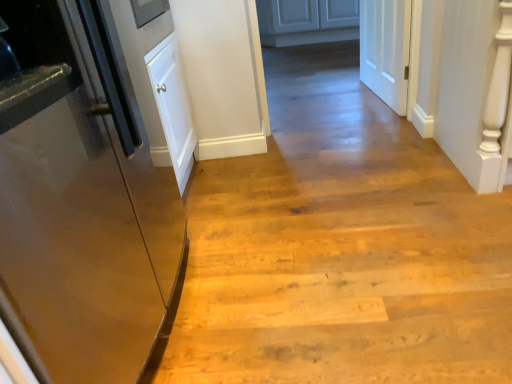
Question: Based on their sizes in the image, would you say white matte door at upper right, which is the second door from bottom to top, is bigger or smaller than matte white cabinets at center?

Choices:
 (A) big
 (B) small

Answer: (B)

Question: Is white matte door at upper right, which appears as the 1th door when viewed from the back, to the left or to the right of matte white cabinets at center in the image?

Choices:
 (A) right
 (B) left

Answer: (A)

Question: Which of these objects is positioned farthest from the glossy metallic refrigerator at left, which is the 2th door from back to front?

Choices:
 (A) matte white cabinets at center
 (B) white matte door at upper right, which appears as the 1th door when viewed from the back

Answer: (A)

Question: Estimate the real-world distances between objects in this image. Which object is closer to the white matte door at upper right, the 1th door when ordered from right to left?

Choices:
 (A) glossy metallic refrigerator at left, the second door in the right-to-left sequence
 (B) matte white cabinets at center

Answer: (A)